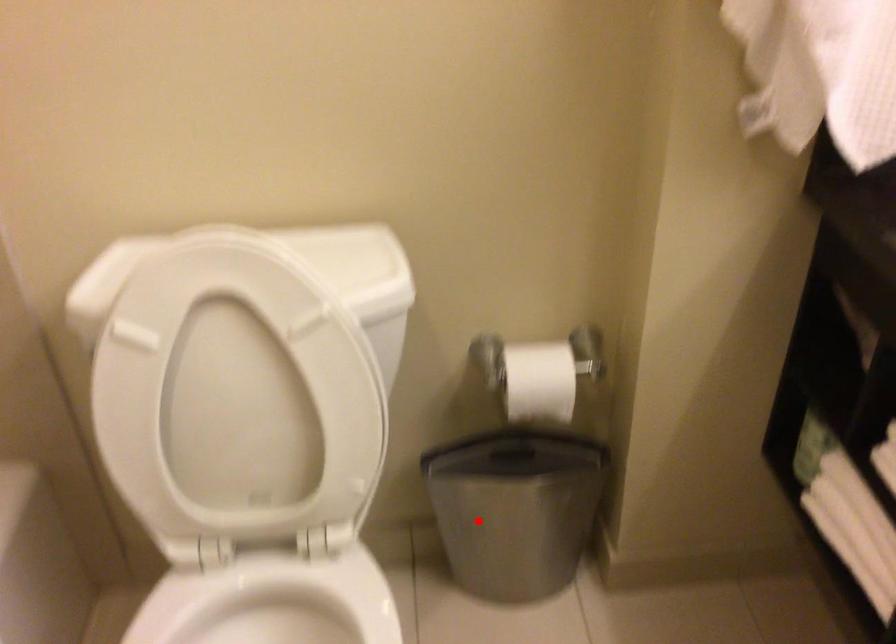
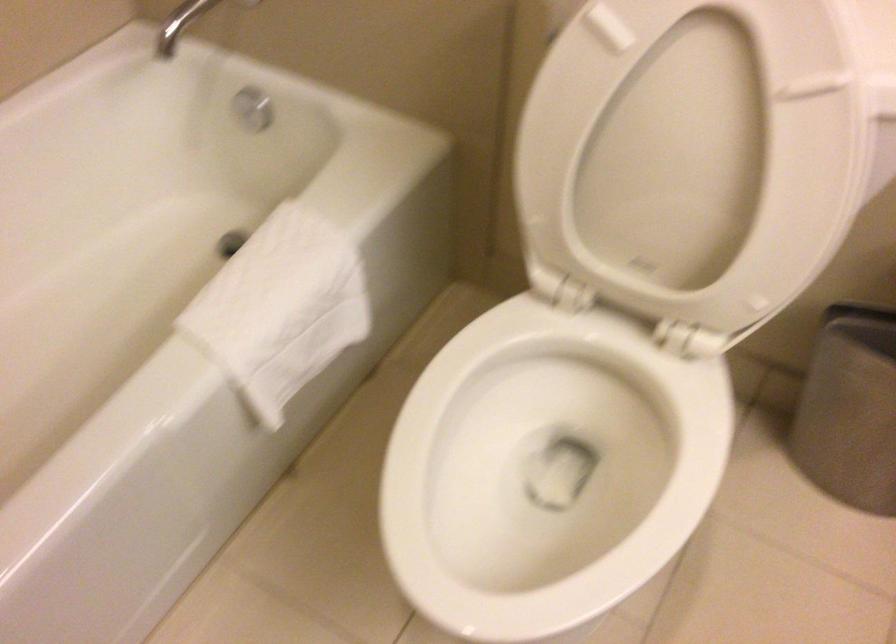
Locate, in the second image, the point that corresponds to the highlighted location in the first image.

(858, 402)